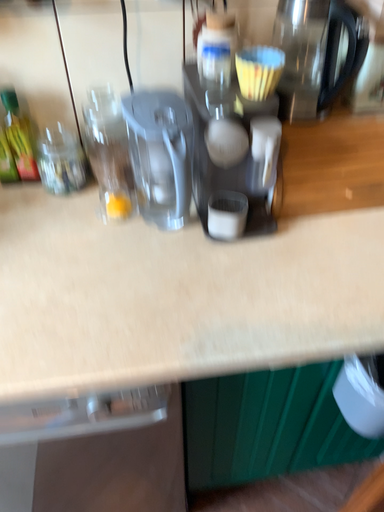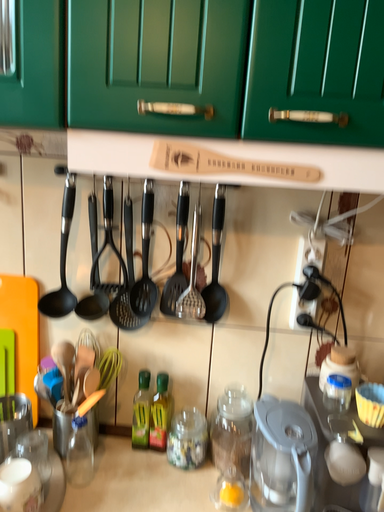
Question: Which way did the camera rotate in the video?

Choices:
 (A) rotated downward
 (B) rotated upward

Answer: (B)